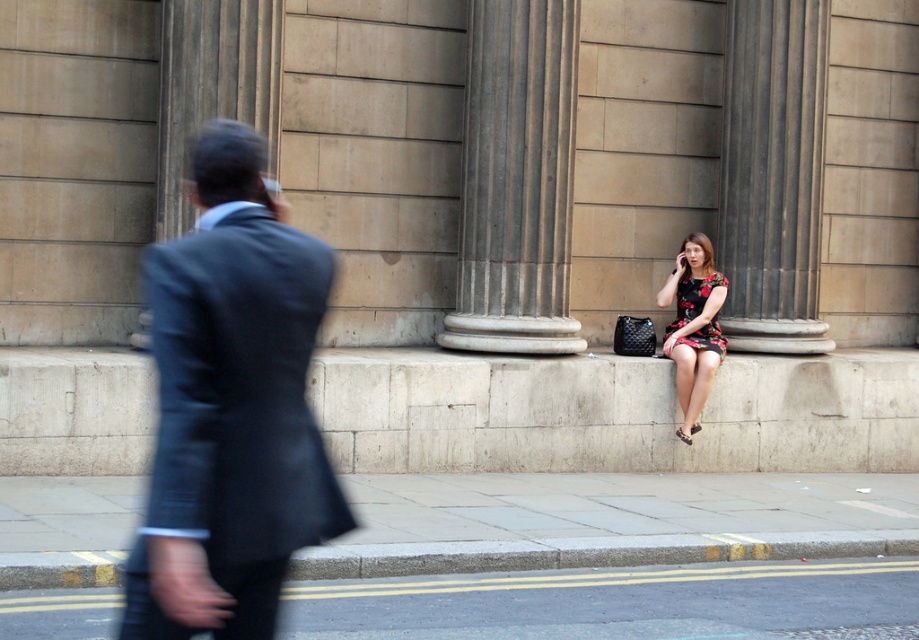
Can you confirm if smooth asphalt road at lower center is thinner than gray marble column at center?

Incorrect, smooth asphalt road at lower center's width is not less than gray marble column at center's.

Between point (694, 620) and point (543, 193), which one is positioned behind?

The point (543, 193) is behind.

The width and height of the screenshot is (919, 640). What are the coordinates of `smooth asphalt road at lower center` in the screenshot? It's located at (x=618, y=602).

From the picture: Is dark gray suit at left wider than floral dress at center?

No.

Does dark gray suit at left come behind floral dress at center?

No, dark gray suit at left is in front of floral dress at center.

Who is more forward, (347, 509) or (685, 376)?

Point (347, 509) is in front.

Where is `dark gray suit at left`? dark gray suit at left is located at coordinates (230, 406).

Is gray marble column at center thinner than black polished stone column at center?

No, gray marble column at center is not thinner than black polished stone column at center.

Image resolution: width=919 pixels, height=640 pixels. Describe the element at coordinates (516, 180) in the screenshot. I see `gray marble column at center` at that location.

Find the location of a particular element. gray marble column at center is located at coordinates (516, 180).